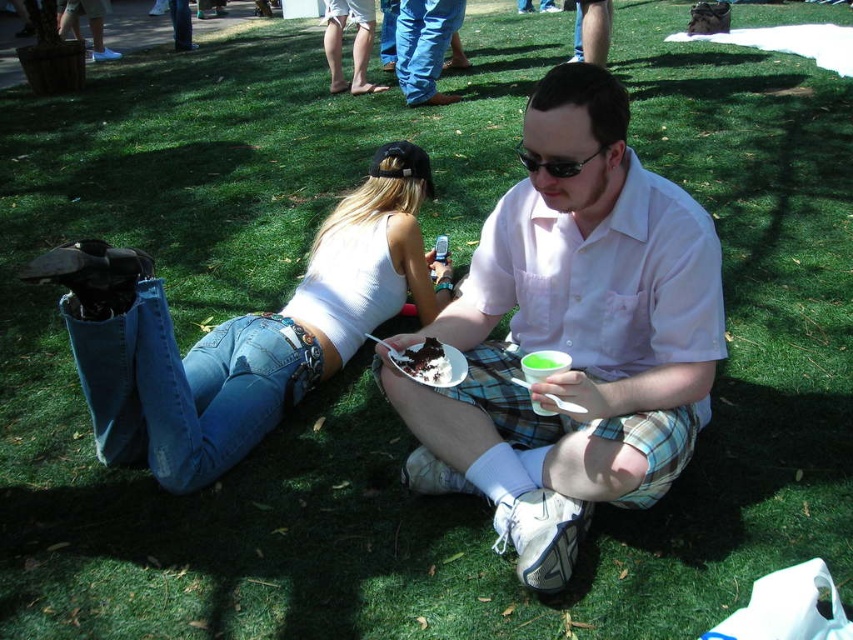
Question: Which is farther from the black plastic goggles at center?

Choices:
 (A) chocolate cake at center
 (B) denim jeans at lower left
 (C) white cotton shirt at center

Answer: (B)

Question: Which of the following is the farthest from the observer?

Choices:
 (A) (526, 163)
 (B) (114, 385)
 (C) (428, 344)
 (D) (606, 458)

Answer: (B)

Question: Does white cotton shirt at center come in front of black plastic goggles at center?

Choices:
 (A) yes
 (B) no

Answer: (A)

Question: Can you confirm if chocolate cake at center is positioned to the left of black plastic goggles at center?

Choices:
 (A) yes
 (B) no

Answer: (A)

Question: Does white cotton shirt at center appear over black plastic goggles at center?

Choices:
 (A) no
 (B) yes

Answer: (A)

Question: Which of these objects is positioned closest to the denim jeans at lower left?

Choices:
 (A) chocolate cake at center
 (B) white cotton shirt at center
 (C) black plastic goggles at center

Answer: (A)